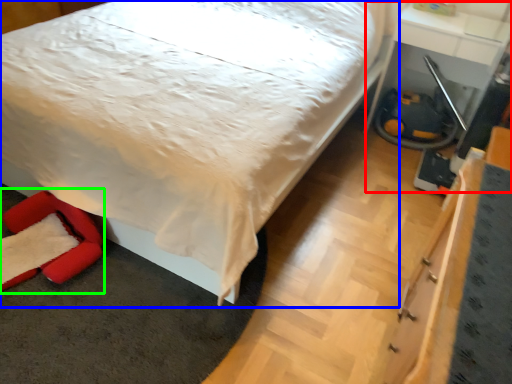
Question: Which is farther away from table (highlighted by a red box)? bed (highlighted by a blue box) or swivel chair (highlighted by a green box)?

Choices:
 (A) bed
 (B) swivel chair

Answer: (B)